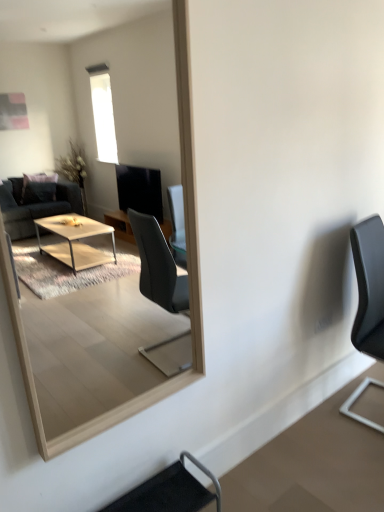
Question: Should I look upward or downward to see black leather chair at lower center, the 1th chair when ordered from left to right?

Choices:
 (A) up
 (B) down

Answer: (B)

Question: Can you confirm if black matte chair at right, the 2th chair positioned from the bottom, is positioned to the left of wooden frame mirror at center?

Choices:
 (A) no
 (B) yes

Answer: (A)

Question: Considering the relative positions of black matte chair at right, arranged as the 2th chair when viewed from the front, and wooden frame mirror at center in the image provided, is black matte chair at right, arranged as the 2th chair when viewed from the front, in front of wooden frame mirror at center?

Choices:
 (A) no
 (B) yes

Answer: (A)

Question: Considering the relative sizes of black matte chair at right, which is the first chair from right to left, and wooden frame mirror at center in the image provided, is black matte chair at right, which is the first chair from right to left, smaller than wooden frame mirror at center?

Choices:
 (A) no
 (B) yes

Answer: (A)

Question: Does black matte chair at right, which appears as the second chair when viewed from the left, have a lesser width compared to wooden frame mirror at center?

Choices:
 (A) no
 (B) yes

Answer: (A)

Question: Is black matte chair at right, which appears as the second chair when viewed from the left, oriented towards wooden frame mirror at center?

Choices:
 (A) no
 (B) yes

Answer: (A)

Question: From a real-world perspective, is black matte chair at right, which appears as the second chair when viewed from the left, beneath wooden frame mirror at center?

Choices:
 (A) no
 (B) yes

Answer: (B)

Question: Is black matte chair at right, which is the first chair from right to left, bigger than black leather chair at lower center, acting as the 1th chair starting from the bottom?

Choices:
 (A) yes
 (B) no

Answer: (A)

Question: Can you confirm if black matte chair at right, arranged as the 2th chair when viewed from the front, is positioned to the right of black leather chair at lower center, the 1th chair when ordered from left to right?

Choices:
 (A) no
 (B) yes

Answer: (B)

Question: Would you say black matte chair at right, which is the first chair from right to left, contains black leather chair at lower center, acting as the 1th chair starting from the bottom?

Choices:
 (A) no
 (B) yes

Answer: (A)

Question: Does black matte chair at right, acting as the first chair starting from the back, lie behind black leather chair at lower center, the 1th chair when ordered from left to right?

Choices:
 (A) yes
 (B) no

Answer: (A)

Question: Is black matte chair at right, positioned as the 1th chair in top-to-bottom order, placed right next to black leather chair at lower center, the 1th chair when ordered from left to right?

Choices:
 (A) no
 (B) yes

Answer: (A)

Question: Does black matte chair at right, positioned as the 1th chair in top-to-bottom order, have a greater width compared to black leather chair at lower center, the second chair from the back?

Choices:
 (A) yes
 (B) no

Answer: (A)

Question: Considering the relative sizes of black leather chair at lower center, placed as the second chair when sorted from top to bottom, and black matte chair at right, positioned as the 1th chair in top-to-bottom order, in the image provided, is black leather chair at lower center, placed as the second chair when sorted from top to bottom, bigger than black matte chair at right, positioned as the 1th chair in top-to-bottom order,?

Choices:
 (A) yes
 (B) no

Answer: (B)